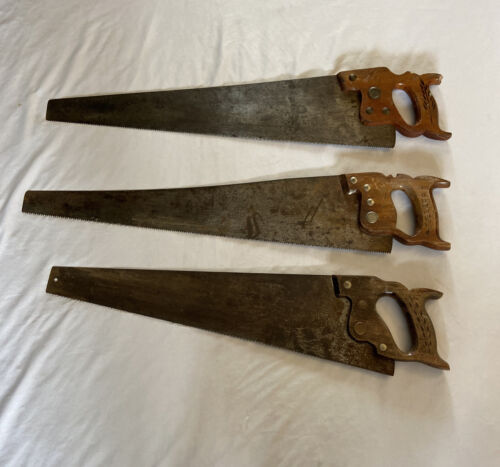
The image size is (500, 467). Identify the location of white sheet. (176, 382).